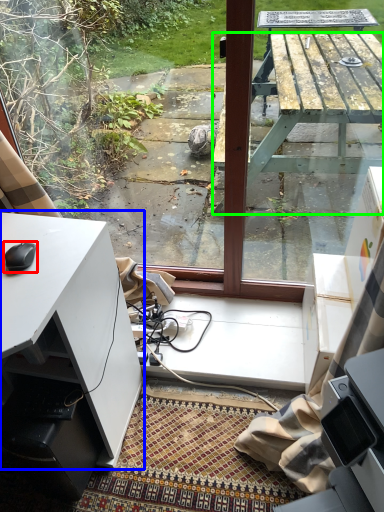
Question: Estimate the real-world distances between objects in this image. Which object is farther from mouse (highlighted by a red box), desk (highlighted by a blue box) or table (highlighted by a green box)?

Choices:
 (A) desk
 (B) table

Answer: (B)